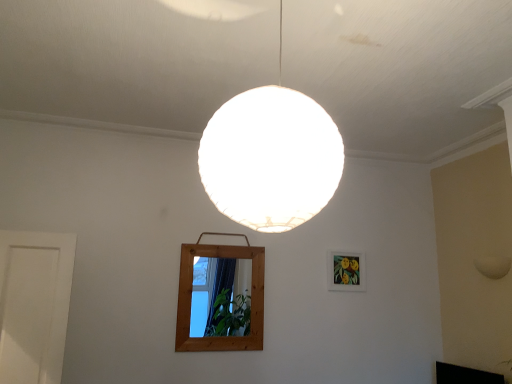
Question: In terms of height, does matte wooden picture frame at upper right look taller or shorter compared to white matte sphere at center?

Choices:
 (A) tall
 (B) short

Answer: (B)

Question: Based on their positions, is matte wooden picture frame at upper right located to the left or right of white matte sphere at center?

Choices:
 (A) right
 (B) left

Answer: (A)

Question: Which is nearer to the white matte sphere at center?

Choices:
 (A) wooden mirror at center
 (B) matte wooden picture frame at upper right
 (C) black glossy tv at lower right

Answer: (A)

Question: Which of these objects is positioned farthest from the black glossy tv at lower right?

Choices:
 (A) wooden mirror at center
 (B) white matte sphere at center
 (C) matte wooden picture frame at upper right

Answer: (B)